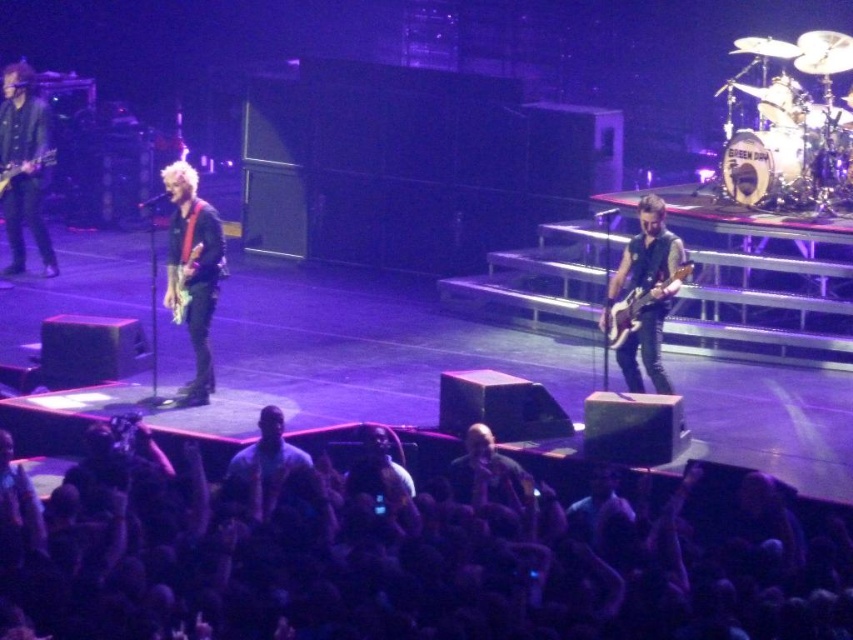
Between black fabric crowd at lower center and matte black bass at center, which one appears on the left side from the viewer's perspective?

From the viewer's perspective, black fabric crowd at lower center appears more on the left side.

Can you confirm if black fabric crowd at lower center is wider than matte black bass at center?

Correct, the width of black fabric crowd at lower center exceeds that of matte black bass at center.

Does point (723, 525) come in front of point (605, 324)?

Yes, point (723, 525) is closer to viewer.

Identify the location of black fabric crowd at lower center. This screenshot has width=853, height=640. (401, 564).

Measure the distance between black fabric crowd at lower center and matte red electric guitar at left.

The distance of black fabric crowd at lower center from matte red electric guitar at left is 7.24 meters.

Who is more forward, (776,541) or (30,170)?

Point (776,541) is in front.

Which is in front, point (122, 592) or point (3, 186)?

Point (122, 592) is more forward.

Identify the location of black fabric crowd at lower center. The image size is (853, 640). (401, 564).

Based on the photo, who is shorter, glossy electric guitar at center or matte red electric guitar at left?

With less height is matte red electric guitar at left.

From the picture: Which is above, glossy electric guitar at center or matte red electric guitar at left?

matte red electric guitar at left

Does point (178, 305) come behind point (20, 166)?

No, it is in front of (20, 166).

Locate an element on the screen. The image size is (853, 640). glossy electric guitar at center is located at coordinates (181, 282).